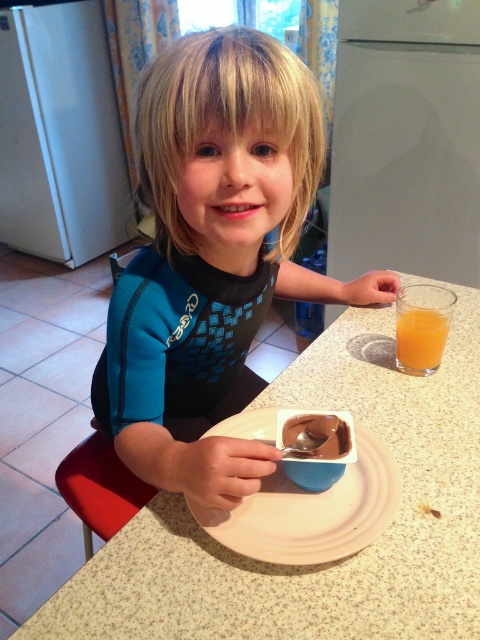
Question: Considering the real-world distances, which object is closest to the blue matte shirt at center?

Choices:
 (A) white matte plate at center
 (B) white speckled table at center

Answer: (A)

Question: Is blue matte shirt at center positioned in front of metallic spoon at plate center?

Choices:
 (A) no
 (B) yes

Answer: (B)

Question: Among these points, which one is nearest to the camera?

Choices:
 (A) (419, 340)
 (B) (328, 516)

Answer: (B)

Question: Is white speckled table at center to the right of translucent glass cup at right from the viewer's perspective?

Choices:
 (A) no
 (B) yes

Answer: (A)

Question: Which of the following is the closest to the observer?

Choices:
 (A) blue matte shirt at center
 (B) translucent glass cup at right

Answer: (A)

Question: Does translucent glass cup at right have a larger size compared to metallic spoon at plate center?

Choices:
 (A) yes
 (B) no

Answer: (A)